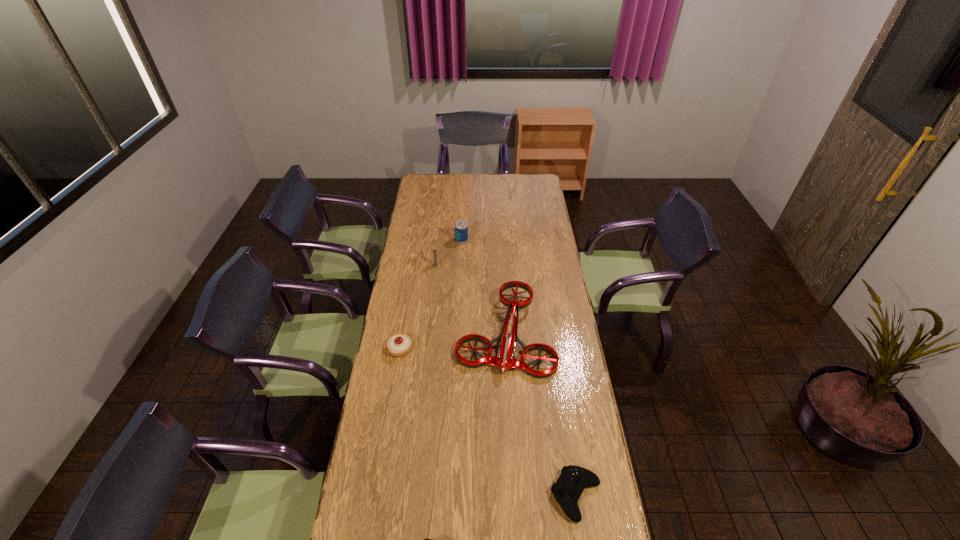
Image resolution: width=960 pixels, height=540 pixels. I want to click on free space located 0.360m on the front of the second farthest object, so click(x=430, y=319).

At what (x,y) coordinates should I click in order to perform the action: click on vacant space situated on the front of the pastry. Please return your answer as a coordinate pair (x, y). This screenshot has height=540, width=960. Looking at the image, I should click on (394, 386).

At what (x,y) coordinates should I click in order to perform the action: click on vacant space located 0.360m on the back of the control. Please return your answer as a coordinate pair (x, y). The height and width of the screenshot is (540, 960). Looking at the image, I should click on (559, 381).

This screenshot has height=540, width=960. I want to click on object at the left edge, so click(x=398, y=345).

Identify the location of drone that is at the right edge. The height and width of the screenshot is (540, 960). (505, 359).

Find the location of a particular element. This screenshot has width=960, height=540. control that is at the right edge is located at coordinates (568, 488).

The image size is (960, 540). Find the location of `vacant space at the left edge of the desktop`. vacant space at the left edge of the desktop is located at coordinates (410, 220).

In the image, there is a desktop. What are the coordinates of `vacant space at the right edge` in the screenshot? It's located at (552, 305).

Identify the location of vacant space at the far left corner of the desktop. This screenshot has width=960, height=540. (439, 190).

Where is `vacant area at the far right corner of the desktop`? vacant area at the far right corner of the desktop is located at coordinates (534, 190).